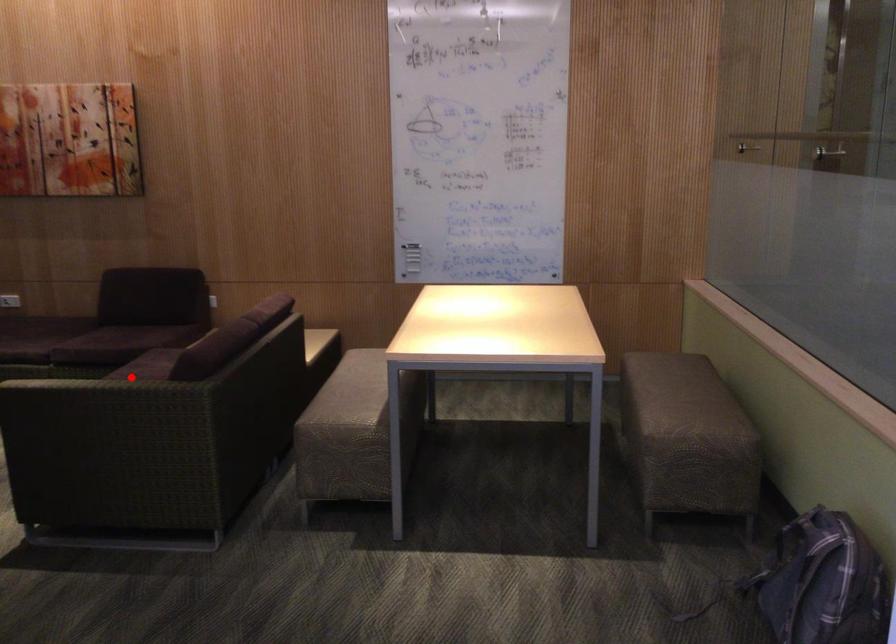
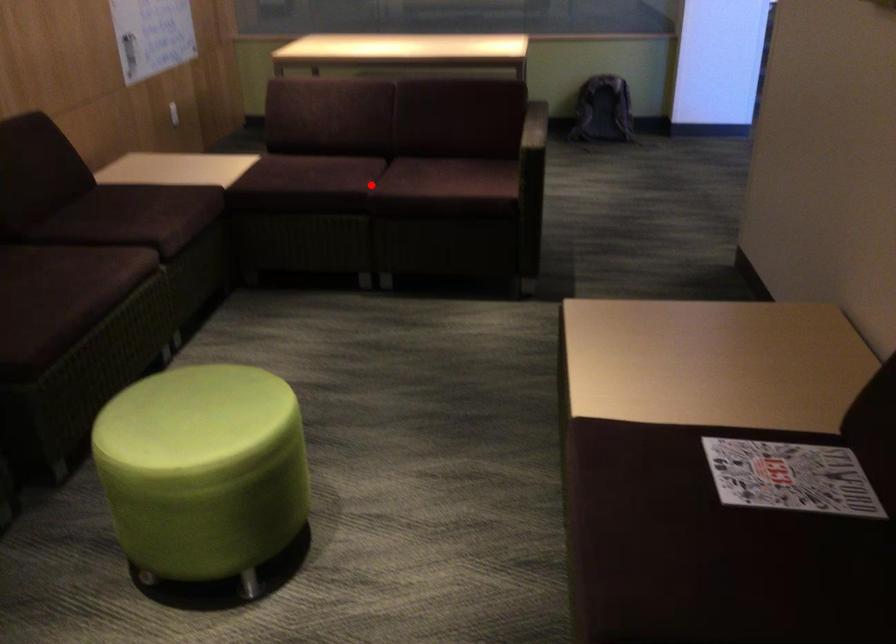
I am providing you with two images of the same scene from different viewpoints. A red point is marked on the first image and another point is marked on the second image. Is the red point in image1 aligned with the point shown in image2?

Yes